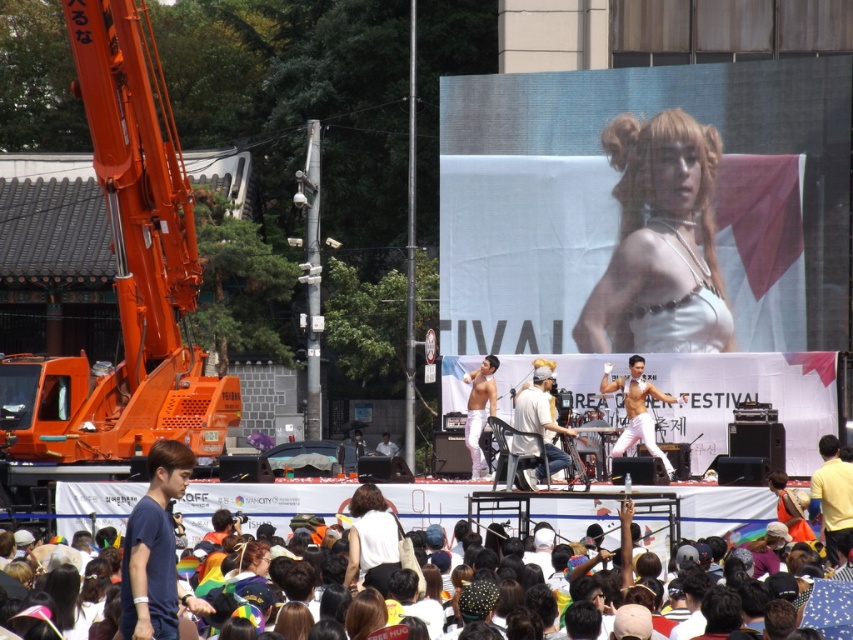
Question: Which of the following is the closest to the observer?

Choices:
 (A) shiny silver pants at center
 (B) white cotton shirt at center

Answer: (B)

Question: Which object is closer to the camera taking this photo?

Choices:
 (A) white satin dress at upper center
 (B) shiny silver pants at stage center

Answer: (B)

Question: Considering the relative positions of white cotton shirt at center and shiny silver pants at stage center in the image provided, where is white cotton shirt at center located with respect to shiny silver pants at stage center?

Choices:
 (A) right
 (B) left

Answer: (A)

Question: Which object is positioned farthest from the white satin dress at upper center?

Choices:
 (A) white cotton shirt at center
 (B) yellow cotton shirt at center

Answer: (B)

Question: Is the position of white satin dress at upper center more distant than that of shiny silver pants at stage center?

Choices:
 (A) yes
 (B) no

Answer: (A)

Question: Considering the relative positions of yellow cotton shirt at center and shiny silver pants at stage center in the image provided, where is yellow cotton shirt at center located with respect to shiny silver pants at stage center?

Choices:
 (A) below
 (B) above

Answer: (A)